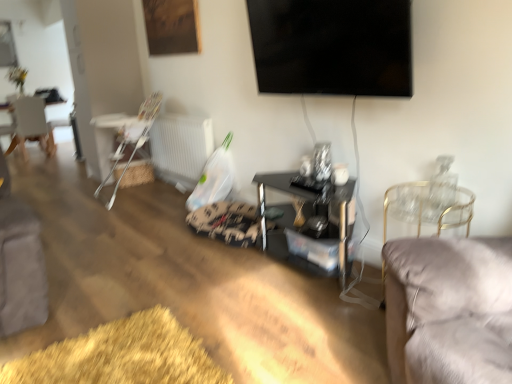
Question: Is velvet grey chair at right, which ranks as the first chair in right-to-left order, smaller than white plastic highchair at left, the 2th chair viewed from the front?

Choices:
 (A) yes
 (B) no

Answer: (A)

Question: Can you see velvet grey chair at right, the first chair from the front, touching white plastic highchair at left, which appears as the second chair when viewed from the right?

Choices:
 (A) yes
 (B) no

Answer: (B)

Question: From the image's perspective, is velvet grey chair at right, the first chair from the front, on white plastic highchair at left, the 2th chair viewed from the front?

Choices:
 (A) no
 (B) yes

Answer: (A)

Question: Can you confirm if velvet grey chair at right, which ranks as the first chair in right-to-left order, is positioned to the right of white plastic highchair at left, which is the 2th chair in left-to-right order?

Choices:
 (A) yes
 (B) no

Answer: (A)

Question: Is white plastic highchair at left, which is the 2th chair in left-to-right order, at the back of velvet grey chair at right, marked as the 3th chair in a left-to-right arrangement?

Choices:
 (A) yes
 (B) no

Answer: (B)

Question: Is the position of velvet grey chair at right, marked as the 3th chair in a left-to-right arrangement, more distant than that of white plastic highchair at left, the 2th chair viewed from the front?

Choices:
 (A) yes
 (B) no

Answer: (B)

Question: Is white wooden chair at left, the 1th chair in the back-to-front sequence, at the back of white plastic highchair at left, which is the second chair from back to front?

Choices:
 (A) no
 (B) yes

Answer: (A)

Question: Is white plastic highchair at left, which is the 2th chair in left-to-right order, placed right next to white wooden chair at left, the 3th chair in the front-to-back sequence?

Choices:
 (A) yes
 (B) no

Answer: (B)

Question: Can you confirm if white plastic highchair at left, which appears as the second chair when viewed from the right, is taller than white wooden chair at left, the 1th chair in the back-to-front sequence?

Choices:
 (A) yes
 (B) no

Answer: (A)

Question: Is the depth of white plastic highchair at left, the 2th chair viewed from the front, less than that of white wooden chair at left, which is counted as the 3th chair, starting from the right?

Choices:
 (A) no
 (B) yes

Answer: (B)

Question: Is white plastic highchair at left, which is the 2th chair in left-to-right order, to the right of white wooden chair at left, which is counted as the 3th chair, starting from the right, from the viewer's perspective?

Choices:
 (A) no
 (B) yes

Answer: (B)

Question: Are white plastic highchair at left, which is the 2th chair in left-to-right order, and white wooden chair at left, the 1th chair in the back-to-front sequence, located far from each other?

Choices:
 (A) no
 (B) yes

Answer: (B)

Question: Is white plastic radiator at lower center outside white plastic highchair at left, the 2th chair viewed from the front?

Choices:
 (A) yes
 (B) no

Answer: (A)